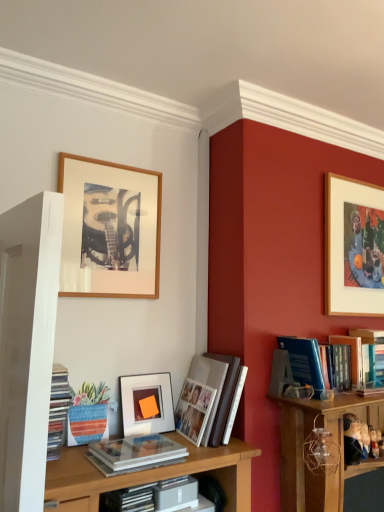
Question: Is gray matte book at center at the right side of matte plastic books at left, which ranks as the fifth book in right-to-left order?

Choices:
 (A) no
 (B) yes

Answer: (B)

Question: Is gray matte book at center oriented towards matte plastic books at left, which ranks as the fifth book in right-to-left order?

Choices:
 (A) yes
 (B) no

Answer: (B)

Question: Can you confirm if gray matte book at center is shorter than matte plastic books at left, which ranks as the fifth book in right-to-left order?

Choices:
 (A) yes
 (B) no

Answer: (A)

Question: From a real-world perspective, is gray matte book at center physically below matte plastic books at left, which ranks as the fifth book in right-to-left order?

Choices:
 (A) no
 (B) yes

Answer: (B)

Question: Is matte plastic books at left, which ranks as the fifth book in right-to-left order, completely or partially inside gray matte book at center?

Choices:
 (A) yes
 (B) no

Answer: (B)

Question: Is gray matte book at center beside matte plastic books at left, marked as the first book in a left-to-right arrangement?

Choices:
 (A) yes
 (B) no

Answer: (B)

Question: Is matte plastic books at left, marked as the first book in a left-to-right arrangement, turned away from white paper photo album at center, acting as the 3th book starting from the left?

Choices:
 (A) yes
 (B) no

Answer: (B)

Question: Does matte plastic books at left, which ranks as the fifth book in right-to-left order, come behind white paper photo album at center, which is the third book from right to left?

Choices:
 (A) yes
 (B) no

Answer: (B)

Question: Does matte plastic books at left, which ranks as the fifth book in right-to-left order, appear on the left side of white paper photo album at center, which is the third book from right to left?

Choices:
 (A) no
 (B) yes

Answer: (B)

Question: Is matte plastic books at left, which ranks as the fifth book in right-to-left order, positioned before white paper photo album at center, acting as the 3th book starting from the left?

Choices:
 (A) no
 (B) yes

Answer: (B)

Question: From the image's perspective, is matte plastic books at left, marked as the first book in a left-to-right arrangement, under white paper photo album at center, which is the third book from right to left?

Choices:
 (A) yes
 (B) no

Answer: (B)

Question: Does matte plastic books at left, marked as the first book in a left-to-right arrangement, have a greater height compared to white paper photo album at center, which is the third book from right to left?

Choices:
 (A) no
 (B) yes

Answer: (A)

Question: Does blue hardcover book at center-right, which ranks as the fourth book in left-to-right order, have a larger size compared to matte white book at center, which ranks as the 4th book in right-to-left order?

Choices:
 (A) no
 (B) yes

Answer: (B)